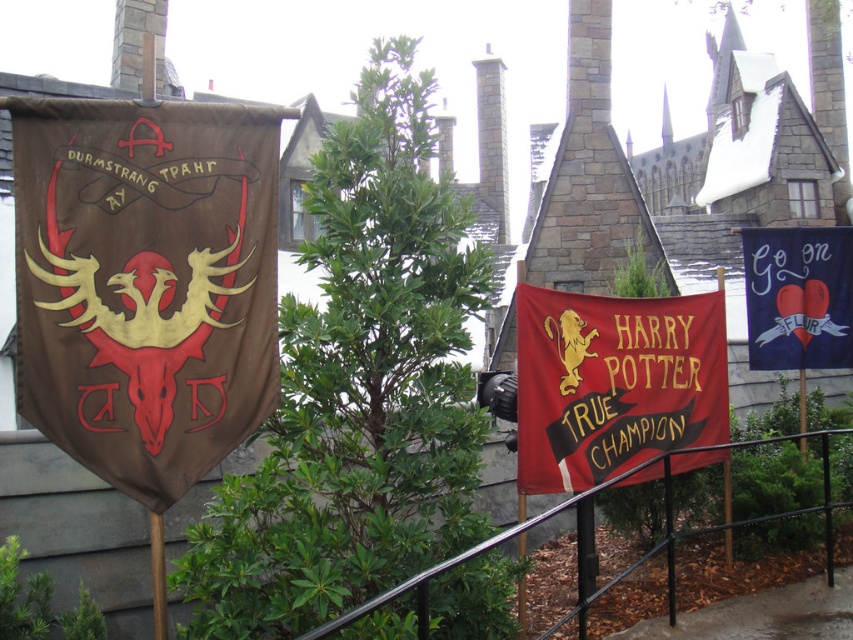
Between brown leather banner at left and red velvet banner at center, which one is positioned lower?

red velvet banner at center is below.

Between point (91, 372) and point (531, 481), which one is positioned in front?

Point (91, 372) is in front.

In order to click on brown leather banner at left in this screenshot , I will do `click(144, 282)`.

Where is `brown leather banner at left`? The image size is (853, 640). brown leather banner at left is located at coordinates (144, 282).

Is the position of red velvet banner at center more distant than that of navy blue fabric banner at upper right?

No, red velvet banner at center is in front of navy blue fabric banner at upper right.

Between red velvet banner at center and navy blue fabric banner at upper right, which one appears on the left side from the viewer's perspective?

red velvet banner at center is more to the left.

Is point (572, 380) positioned before point (756, 252)?

Yes, point (572, 380) is in front of point (756, 252).

At what (x,y) coordinates should I click in order to perform the action: click on red velvet banner at center. Please return your answer as a coordinate pair (x, y). This screenshot has width=853, height=640. Looking at the image, I should click on (614, 381).

Which is more to the left, brown leather banner at left or navy blue fabric banner at upper right?

brown leather banner at left is more to the left.

Can you confirm if brown leather banner at left is positioned above navy blue fabric banner at upper right?

No, brown leather banner at left is not above navy blue fabric banner at upper right.

You are a GUI agent. You are given a task and a screenshot of the screen. Output one action in this format:
    pyautogui.click(x=<x>, y=<y>)
    Task: Click on the brown leather banner at left
    The height and width of the screenshot is (640, 853).
    Given the screenshot: What is the action you would take?
    coord(144,282)